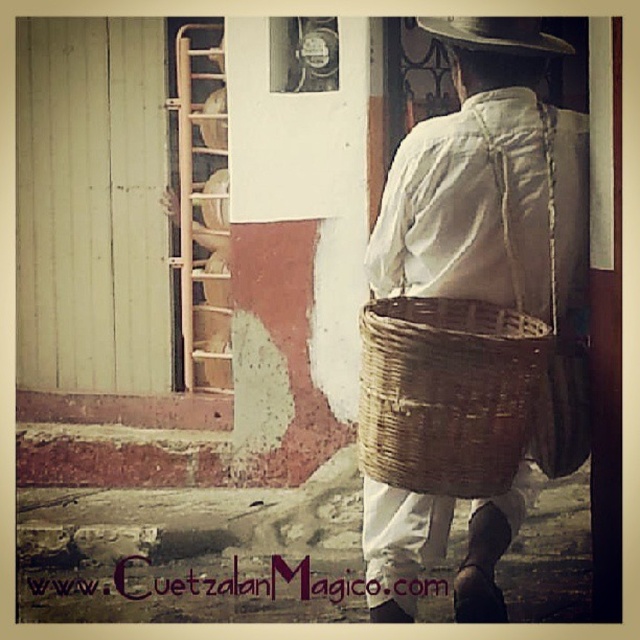
Question: Estimate the real-world distances between objects in this image. Which object is closer to the woven straw basket at back?

Choices:
 (A) brown woven straw hat at upper center
 (B) woven brown basket at back

Answer: (A)

Question: Does woven straw basket at back appear under brown woven straw hat at upper center?

Choices:
 (A) no
 (B) yes

Answer: (B)

Question: Which of these objects is positioned closest to the woven brown basket at back?

Choices:
 (A) woven straw basket at back
 (B) brown woven straw hat at upper center

Answer: (A)

Question: Is woven straw basket at back wider than woven brown basket at back?

Choices:
 (A) yes
 (B) no

Answer: (A)

Question: Is woven straw basket at back to the right of woven brown basket at back from the viewer's perspective?

Choices:
 (A) yes
 (B) no

Answer: (A)

Question: Which point appears closest to the camera in this image?

Choices:
 (A) (560, 40)
 (B) (465, 355)
 (C) (384, 288)

Answer: (B)